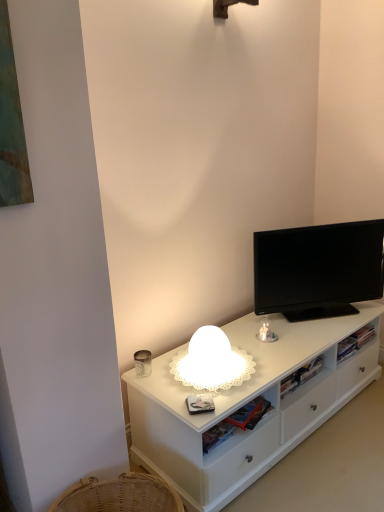
I want to click on black glossy tv at upper right, so click(318, 269).

In order to click on white frosted glass lamp at center in this screenshot , I will do `click(212, 362)`.

Considering the sizes of objects black glossy tv at upper right and white matte cabinet at center in the image provided, who is bigger, black glossy tv at upper right or white matte cabinet at center?

With larger size is white matte cabinet at center.

Can you confirm if black glossy tv at upper right is positioned to the right of white matte cabinet at center?

Correct, you'll find black glossy tv at upper right to the right of white matte cabinet at center.

From the image's perspective, which one is positioned lower, black glossy tv at upper right or white matte cabinet at center?

From the image's view, white matte cabinet at center is below.

Is black glossy tv at upper right inside the boundaries of white matte cabinet at center, or outside?

Result: black glossy tv at upper right is not enclosed by white matte cabinet at center.

From the image's perspective, is white frosted glass lamp at center above white matte cabinet at center?

Indeed, from the image's perspective, white frosted glass lamp at center is shown above white matte cabinet at center.

Based on their positions, is white frosted glass lamp at center located to the left or right of white matte cabinet at center?

white frosted glass lamp at center is to the left of white matte cabinet at center.

Is white frosted glass lamp at center thinner than white matte cabinet at center?

Yes.

From a real-world perspective, which is physically above, white matte cabinet at center or black glossy tv at upper right?

black glossy tv at upper right.

Can you confirm if white matte cabinet at center is taller than black glossy tv at upper right?

Incorrect, the height of white matte cabinet at center is not larger of that of black glossy tv at upper right.

Considering the relative positions of white matte cabinet at center and black glossy tv at upper right in the image provided, is white matte cabinet at center in front of black glossy tv at upper right?

Yes, white matte cabinet at center is closer to the viewer.

Is white matte cabinet at center far away from black glossy tv at upper right?

white matte cabinet at center is near black glossy tv at upper right, not far away.

Which is more to the right, black glossy tv at upper right or white frosted glass lamp at center?

Positioned to the right is black glossy tv at upper right.

From the image's perspective, is black glossy tv at upper right located above or below white frosted glass lamp at center?

From the image's perspective, black glossy tv at upper right appears above white frosted glass lamp at center.

Which point is more distant from viewer, [300,245] or [201,359]?

The point [300,245] is more distant.

Can we say black glossy tv at upper right lies outside white frosted glass lamp at center?

Absolutely, black glossy tv at upper right is external to white frosted glass lamp at center.

Considering the relative positions of white matte cabinet at center and white frosted glass lamp at center in the image provided, is white matte cabinet at center to the right of white frosted glass lamp at center from the viewer's perspective?

Indeed, white matte cabinet at center is positioned on the right side of white frosted glass lamp at center.

From a real-world perspective, is white matte cabinet at center physically located above or below white frosted glass lamp at center?

white matte cabinet at center is situated lower than white frosted glass lamp at center in the real world.

From the picture: Between white matte cabinet at center and white frosted glass lamp at center, which one is positioned behind?

white frosted glass lamp at center is more distant.

From the image's perspective, is white frosted glass lamp at center beneath black glossy tv at upper right?

Yes, from the image's perspective, white frosted glass lamp at center is beneath black glossy tv at upper right.

Is white frosted glass lamp at center placed right next to black glossy tv at upper right?

No, white frosted glass lamp at center is not with black glossy tv at upper right.

Considering the sizes of objects white frosted glass lamp at center and black glossy tv at upper right in the image provided, who is shorter, white frosted glass lamp at center or black glossy tv at upper right?

Standing shorter between the two is white frosted glass lamp at center.

Is white frosted glass lamp at center to the left of black glossy tv at upper right from the viewer's perspective?

Yes.

You are a GUI agent. You are given a task and a screenshot of the screen. Output one action in this format:
    pyautogui.click(x=<x>, y=<y>)
    Task: Click on the cabinetry directly beneath the black glossy tv at upper right (from a real-world perspective)
    The image size is (384, 512).
    Given the screenshot: What is the action you would take?
    pyautogui.click(x=244, y=403)

Identify the location of cabinetry on the right of white frosted glass lamp at center. The image size is (384, 512). (244, 403).

Based on their spatial positions, is white frosted glass lamp at center or black glossy tv at upper right further from white matte cabinet at center?

black glossy tv at upper right lies further to white matte cabinet at center than the other object.

Based on their spatial positions, is black glossy tv at upper right or white frosted glass lamp at center closer to white matte cabinet at center?

white frosted glass lamp at center lies closer to white matte cabinet at center than the other object.

Looking at the image, which one is located closer to black glossy tv at upper right, white matte cabinet at center or white frosted glass lamp at center?

white matte cabinet at center lies closer to black glossy tv at upper right than the other object.

Which object lies nearer to the anchor point black glossy tv at upper right, white frosted glass lamp at center or white matte cabinet at center?

Based on the image, white matte cabinet at center appears to be nearer to black glossy tv at upper right.

Considering their positions, is black glossy tv at upper right positioned closer to white frosted glass lamp at center than white matte cabinet at center?

white matte cabinet at center is closer to white frosted glass lamp at center.

Estimate the real-world distances between objects in this image. Which object is closer to white frosted glass lamp at center, white matte cabinet at center or black glossy tv at upper right?

white matte cabinet at center is closer to white frosted glass lamp at center.

The height and width of the screenshot is (512, 384). Identify the location of lamp between white matte cabinet at center and black glossy tv at upper right in the front-back direction. pos(212,362).